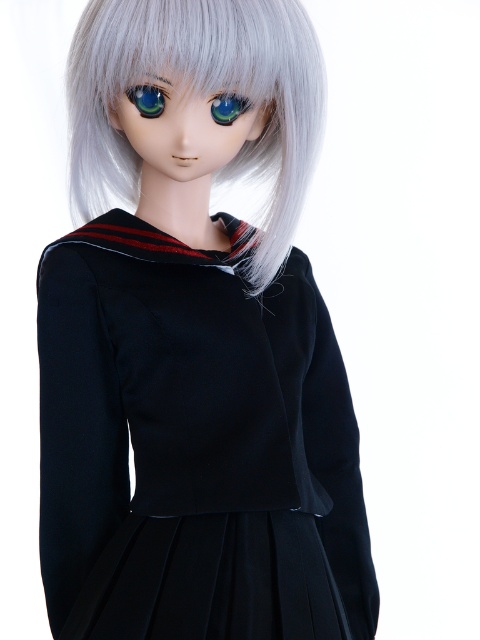
Question: Based on their relative distances, which object is farther from the sleek silver hair at center?

Choices:
 (A) glossy blue eye at center
 (B) green glossy eye at center
 (C) matte black dress at center

Answer: (A)

Question: Does matte black dress at center appear over sleek silver hair at center?

Choices:
 (A) no
 (B) yes

Answer: (A)

Question: Which object appears closest to the camera in this image?

Choices:
 (A) green glossy eye at center
 (B) glossy blue eye at center

Answer: (A)

Question: Considering the relative positions of sleek silver hair at center and green glossy eye at center in the image provided, where is sleek silver hair at center located with respect to green glossy eye at center?

Choices:
 (A) right
 (B) left

Answer: (B)

Question: Is the position of matte black dress at center less distant than that of glossy blue eye at center?

Choices:
 (A) no
 (B) yes

Answer: (B)

Question: Which is farther from the sleek silver hair at center?

Choices:
 (A) glossy blue eye at center
 (B) green glossy eye at center
 (C) matte black dress at center

Answer: (A)